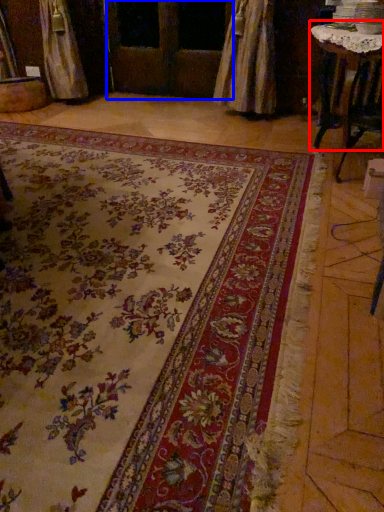
Question: Which object appears closest to the camera in this image, table (highlighted by a red box) or screen door (highlighted by a blue box)?

Choices:
 (A) table
 (B) screen door

Answer: (A)